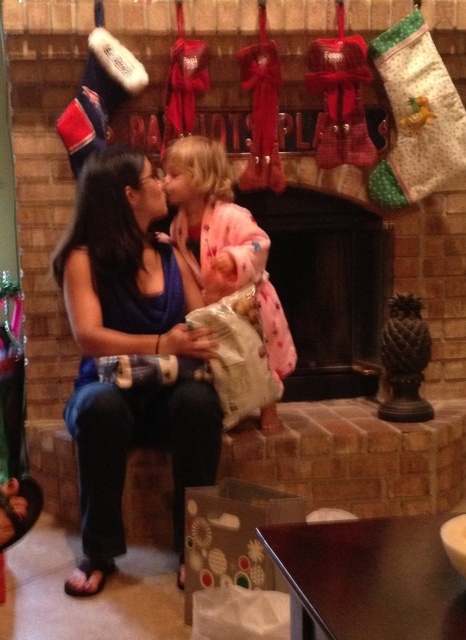
Can you confirm if blue fabric shirt at center is thinner than pink fuzzy robe at center?

No.

Does blue fabric shirt at center have a smaller size compared to pink fuzzy robe at center?

Incorrect, blue fabric shirt at center is not smaller in size than pink fuzzy robe at center.

Identify the location of blue fabric shirt at center. (129, 353).

Is black matte fireplace at center positioned behind pink fuzzy robe at center?

Yes, black matte fireplace at center is further from the viewer.

Which of these two, black matte fireplace at center or pink fuzzy robe at center, stands taller?

Standing taller between the two is pink fuzzy robe at center.

Who is more forward, (334, 256) or (293, 356)?

Point (293, 356) is more forward.

You are a GUI agent. You are given a task and a screenshot of the screen. Output one action in this format:
    pyautogui.click(x=<x>, y=<y>)
    Task: Click on the black matte fireplace at center
    
    Given the screenshot: What is the action you would take?
    pyautogui.click(x=327, y=285)

Looking at this image, does blue fabric shirt at center have a smaller size compared to black matte fireplace at center?

Actually, blue fabric shirt at center might be larger than black matte fireplace at center.

Does blue fabric shirt at center have a lesser width compared to black matte fireplace at center?

Yes.

Between point (144, 433) and point (355, 278), which one is positioned behind?

Point (355, 278)

Locate an element on the screen. blue fabric shirt at center is located at coordinates (129, 353).